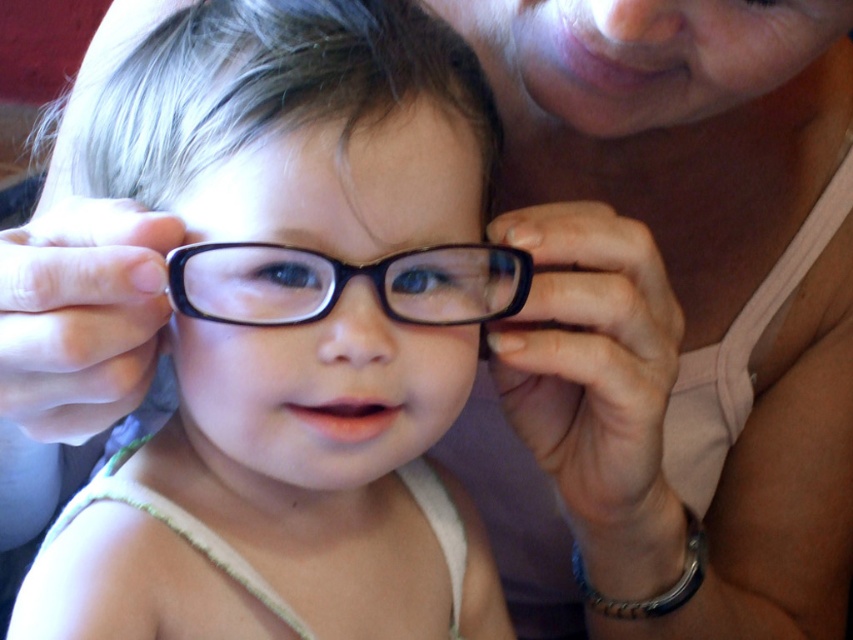
From the picture: Which is more to the left, matte black glasses at center or black plastic glasses at center?

matte black glasses at center

Where is `matte black glasses at center`? The image size is (853, 640). matte black glasses at center is located at coordinates (294, 336).